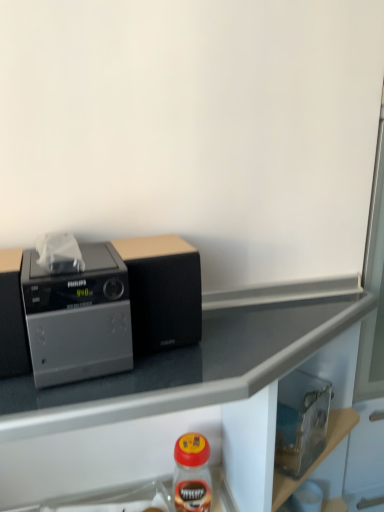
Question: Does black matte speaker at center have a smaller size compared to matte plastic bottle at lower center?

Choices:
 (A) no
 (B) yes

Answer: (A)

Question: Can you confirm if black matte speaker at center is thinner than matte plastic bottle at lower center?

Choices:
 (A) no
 (B) yes

Answer: (A)

Question: Is black matte speaker at center outside of matte plastic bottle at lower center?

Choices:
 (A) no
 (B) yes

Answer: (B)

Question: From the image's perspective, is black matte speaker at center over matte plastic bottle at lower center?

Choices:
 (A) yes
 (B) no

Answer: (A)

Question: Considering the relative positions of black matte speaker at center and matte plastic bottle at lower center in the image provided, is black matte speaker at center in front of matte plastic bottle at lower center?

Choices:
 (A) no
 (B) yes

Answer: (B)

Question: From a real-world perspective, is black matte speaker at center physically above matte plastic bottle at lower center?

Choices:
 (A) yes
 (B) no

Answer: (A)

Question: From the image's perspective, is black matte speaker at center beneath satin silver radio at left?

Choices:
 (A) no
 (B) yes

Answer: (A)

Question: Does black matte speaker at center have a lesser height compared to satin silver radio at left?

Choices:
 (A) no
 (B) yes

Answer: (A)

Question: From a real-world perspective, is black matte speaker at center located beneath satin silver radio at left?

Choices:
 (A) yes
 (B) no

Answer: (B)

Question: Can you confirm if black matte speaker at center is positioned to the left of satin silver radio at left?

Choices:
 (A) no
 (B) yes

Answer: (A)

Question: Considering the relative sizes of black matte speaker at center and satin silver radio at left in the image provided, is black matte speaker at center taller than satin silver radio at left?

Choices:
 (A) no
 (B) yes

Answer: (B)

Question: Can you confirm if black matte speaker at center is bigger than satin silver radio at left?

Choices:
 (A) yes
 (B) no

Answer: (B)

Question: From a real-world perspective, is metallic gray countertop at upper left beneath black matte speaker at center?

Choices:
 (A) no
 (B) yes

Answer: (B)